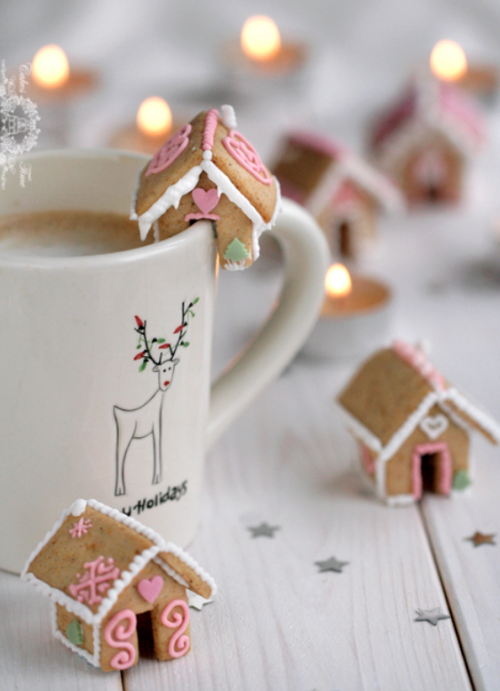
Find the location of a particular element. Image resolution: width=500 pixels, height=691 pixels. 3 wooden panels of table is located at coordinates [31, 661], [277, 663], [470, 625].